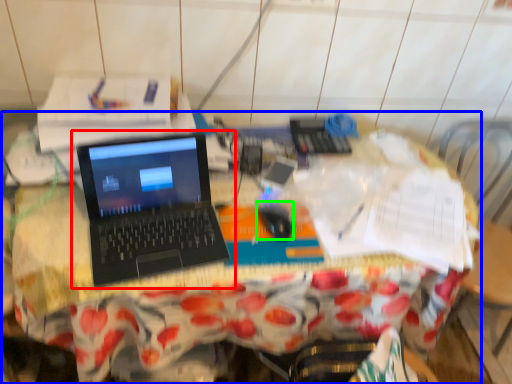
Question: Considering the real-world distances, which object is closest to laptop (highlighted by a red box)? desk (highlighted by a blue box) or mouse (highlighted by a green box).

Choices:
 (A) desk
 (B) mouse

Answer: (A)